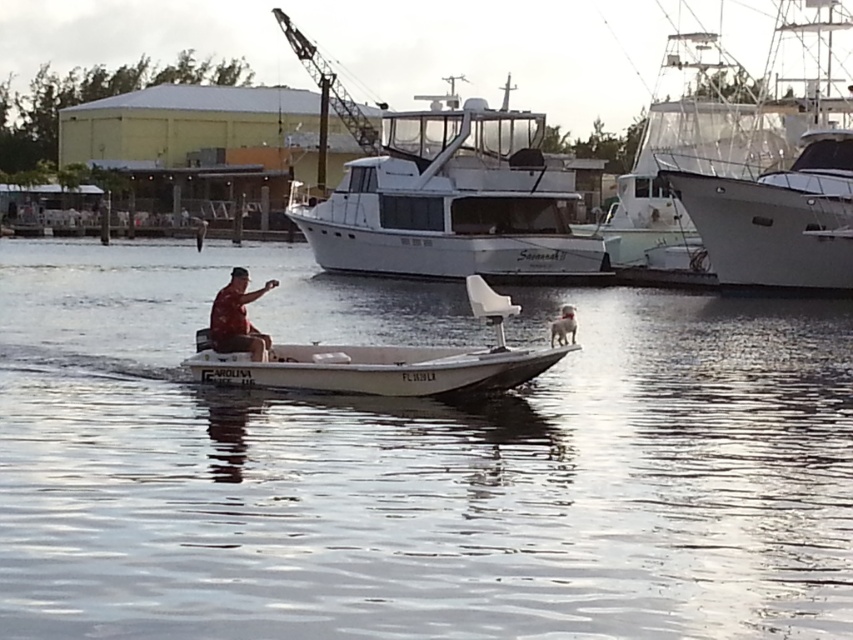
Looking at this image, you are planning to take a photo of the white glossy boat at upper right and the metallic gray crane at upper center. Which object should you zoom in more on to ensure both are clearly visible in the frame?

You should zoom in more on the metallic gray crane at upper center because the white glossy boat at upper right is bigger than the metallic gray crane at upper center, so the crane will appear smaller in the frame and require more zoom to be visible clearly.

You are a photographer trying to capture the reflection of the camouflage fabric shirt at center in the clear water at center. Based on the scene, will the reflection be larger or smaller than the actual shirt?

The clear water at center is bigger than camouflage fabric shirt at center, so the reflection of the camouflage fabric shirt at center in the clear water at center will be larger than the actual shirt.